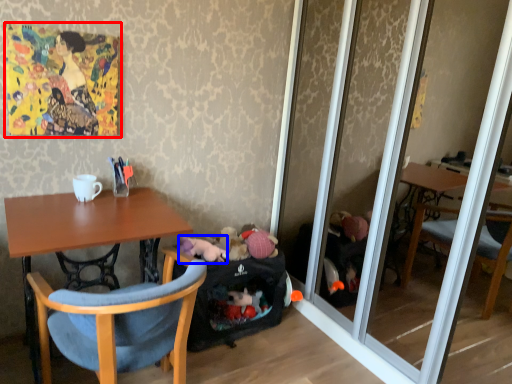
Question: Which object appears closest to the camera in this image, picture frame (highlighted by a red box) or animal (highlighted by a blue box)?

Choices:
 (A) picture frame
 (B) animal

Answer: (A)